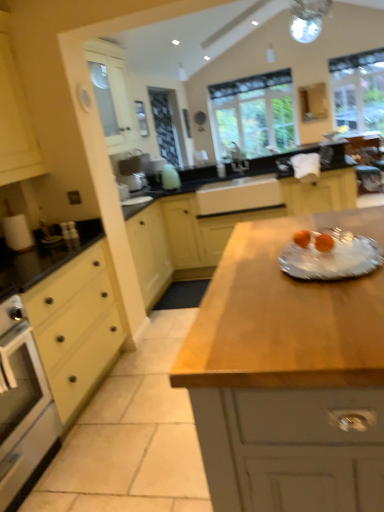
Find the location of a particular element. The image size is (384, 512). free space above wooden at center, the second countertop when ordered from back to front (from a real-world perspective) is located at coordinates (289, 266).